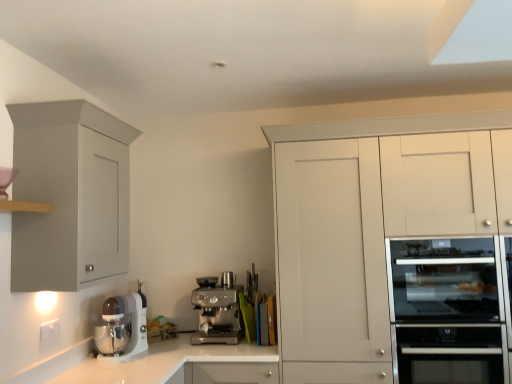
Question: Could you tell me if satin silver oven at right is turned towards white glossy countertop at center?

Choices:
 (A) no
 (B) yes

Answer: (A)

Question: From a real-world perspective, does satin silver oven at right sit lower than white glossy countertop at center?

Choices:
 (A) yes
 (B) no

Answer: (B)

Question: From a real-world perspective, is satin silver oven at right on top of white glossy countertop at center?

Choices:
 (A) yes
 (B) no

Answer: (A)

Question: Is satin silver oven at right closer to camera compared to white glossy countertop at center?

Choices:
 (A) no
 (B) yes

Answer: (B)

Question: Is the depth of satin silver oven at right greater than that of white glossy countertop at center?

Choices:
 (A) yes
 (B) no

Answer: (B)

Question: Does point (391, 289) appear closer or farther from the camera than point (424, 352)?

Choices:
 (A) farther
 (B) closer

Answer: (A)

Question: From a real-world perspective, is satin silver oven at right positioned above or below stainless steel oven at right?

Choices:
 (A) above
 (B) below

Answer: (A)

Question: Looking at the image, does satin silver oven at right seem bigger or smaller compared to stainless steel oven at right?

Choices:
 (A) big
 (B) small

Answer: (A)

Question: Is satin silver oven at right to the left or to the right of stainless steel oven at right in the image?

Choices:
 (A) right
 (B) left

Answer: (B)

Question: Is white matte cabinet at right, the second cabinetry when ordered from left to right, spatially inside stainless steel oven at right, or outside of it?

Choices:
 (A) outside
 (B) inside

Answer: (A)

Question: In the image, is white matte cabinet at right, the first cabinetry in the right-to-left sequence, positioned in front of or behind stainless steel oven at right?

Choices:
 (A) behind
 (B) front

Answer: (B)

Question: Visually, is white matte cabinet at right, the first cabinetry in the right-to-left sequence, positioned to the left or to the right of stainless steel oven at right?

Choices:
 (A) right
 (B) left

Answer: (B)

Question: Is white matte cabinet at right, the first cabinetry in the right-to-left sequence, wider or thinner than stainless steel oven at right?

Choices:
 (A) thin
 (B) wide

Answer: (B)

Question: Is white glossy countertop at center to the left or to the right of satin silver oven at right in the image?

Choices:
 (A) left
 (B) right

Answer: (A)

Question: Does point (274, 354) appear closer or farther from the camera than point (403, 367)?

Choices:
 (A) closer
 (B) farther

Answer: (B)